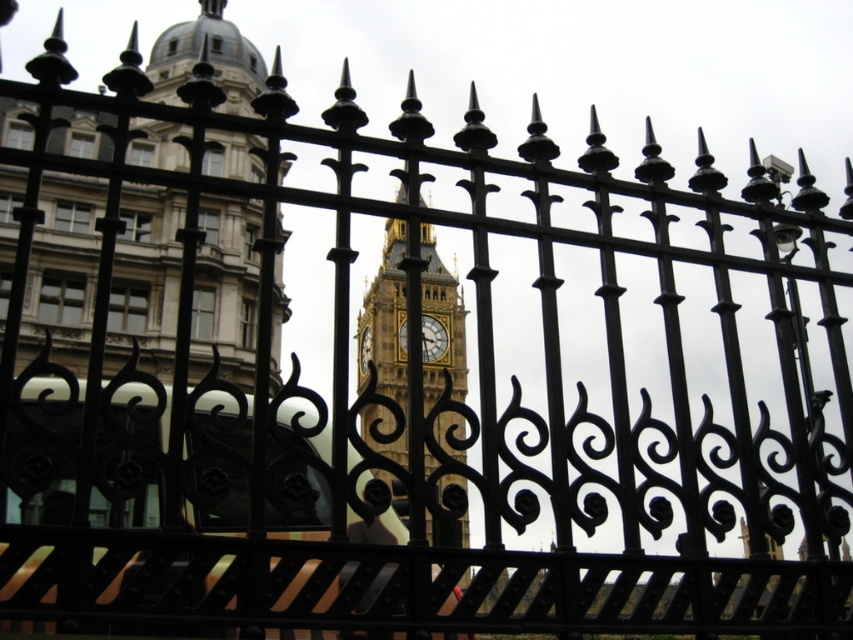
Question: Can you confirm if golden stone clock tower at center is positioned to the left of gold textured clock at center?

Choices:
 (A) yes
 (B) no

Answer: (A)

Question: Is the position of golden stone clock tower at center less distant than that of gold textured clock at center?

Choices:
 (A) yes
 (B) no

Answer: (A)

Question: Which of the following is the farthest from the observer?

Choices:
 (A) (422, 342)
 (B) (384, 412)

Answer: (A)

Question: Which of the following is the closest to the observer?

Choices:
 (A) golden stone clock tower at center
 (B) gold textured clock at center

Answer: (A)

Question: In this image, where is golden stone clock tower at center located relative to gold textured clock at center?

Choices:
 (A) above
 (B) below

Answer: (B)